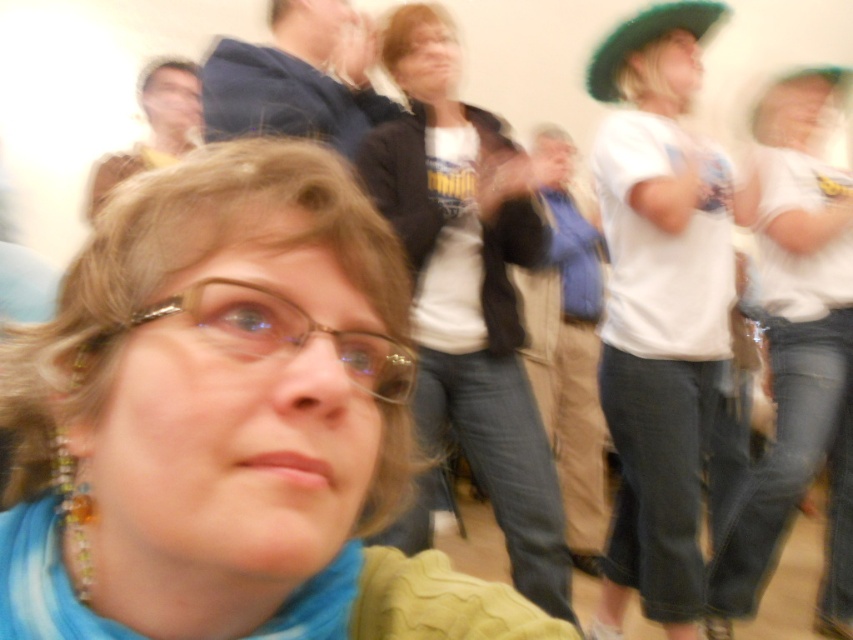
Between point (418, 273) and point (401, 349), which one is positioned in front?

Point (401, 349) is more forward.

Locate an element on the screen. white cotton shirt at center is located at coordinates (469, 288).

Is blue fabric at upper center positioned at the back of green felt hat at upper right?

That is False.

Describe the element at coordinates (297, 77) in the screenshot. The width and height of the screenshot is (853, 640). I see `blue fabric at upper center` at that location.

This screenshot has height=640, width=853. Find the location of `blue fabric at upper center`. blue fabric at upper center is located at coordinates (297, 77).

How much distance is there between blue fabric scarf at lower left and green felt hat at upper right?

blue fabric scarf at lower left and green felt hat at upper right are 1.72 meters apart from each other.

You are a GUI agent. You are given a task and a screenshot of the screen. Output one action in this format:
    pyautogui.click(x=<x>, y=<y>)
    Task: Click on the blue fabric scarf at lower left
    Image resolution: width=853 pixels, height=640 pixels.
    Given the screenshot: What is the action you would take?
    pyautogui.click(x=42, y=580)